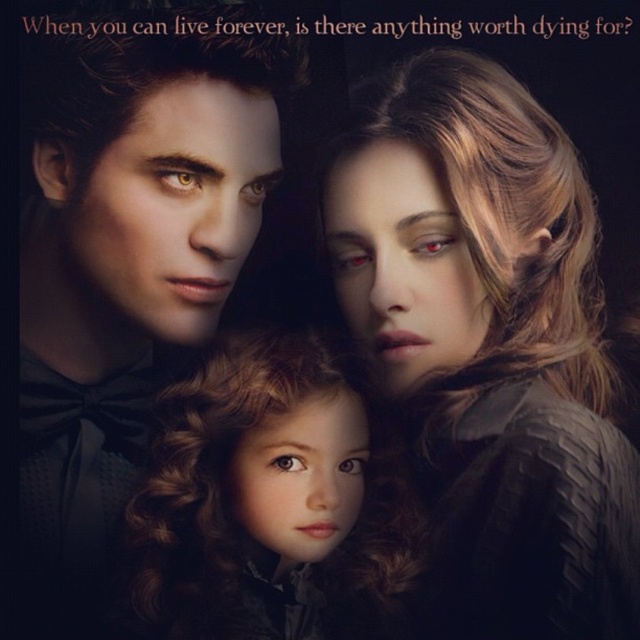
Question: Estimate the real-world distances between objects in this image. Which object is farther from the satin black dress at center?

Choices:
 (A) matte black suit at left
 (B) curly brown hair doll at center

Answer: (A)

Question: Which object is positioned farthest from the matte black suit at left?

Choices:
 (A) satin black dress at center
 (B) curly brown hair doll at center

Answer: (A)

Question: Which point is farther from the camera taking this photo?

Choices:
 (A) (452, 88)
 (B) (120, 100)
 (C) (300, 554)

Answer: (B)

Question: Can you confirm if satin black dress at center is smaller than curly brown hair doll at center?

Choices:
 (A) yes
 (B) no

Answer: (B)

Question: Is satin black dress at center smaller than curly brown hair doll at center?

Choices:
 (A) yes
 (B) no

Answer: (B)

Question: Is satin black dress at center smaller than curly brown hair doll at center?

Choices:
 (A) yes
 (B) no

Answer: (B)